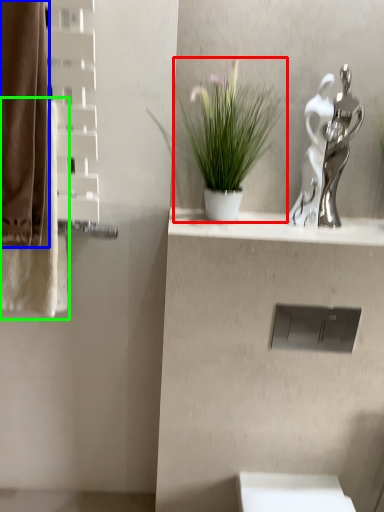
Question: Considering the real-world distances, which object is closest to houseplant (highlighted by a red box)? curtain (highlighted by a blue box) or bath towel (highlighted by a green box).

Choices:
 (A) curtain
 (B) bath towel

Answer: (A)